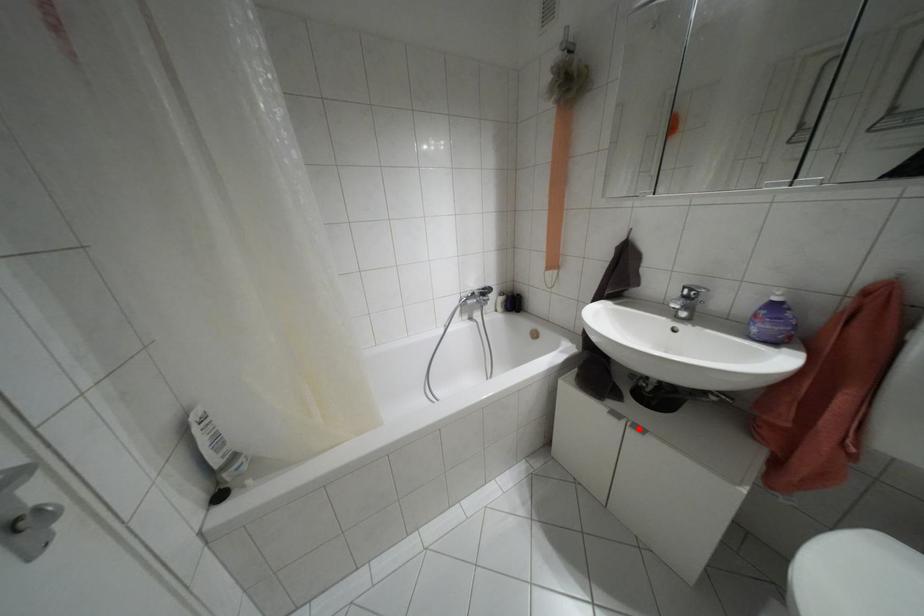
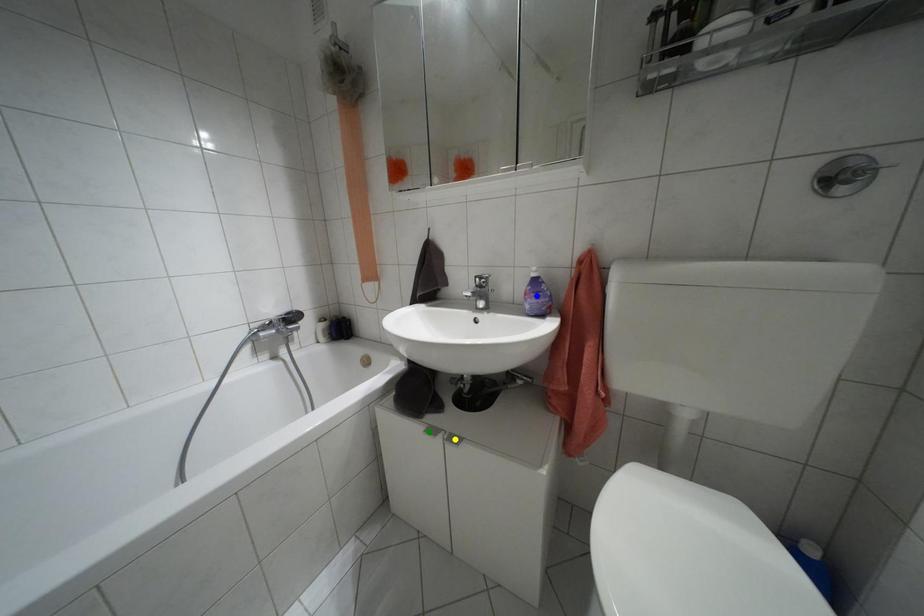
Question: I am providing you with two images of the same scene from different viewpoints. A red point is marked on the first image. You are given multiple points on the second image. Can you choose the point in image 2 that corresponds to the point in image 1?

Choices:
 (A) yellow point
 (B) blue point
 (C) green point

Answer: (A)